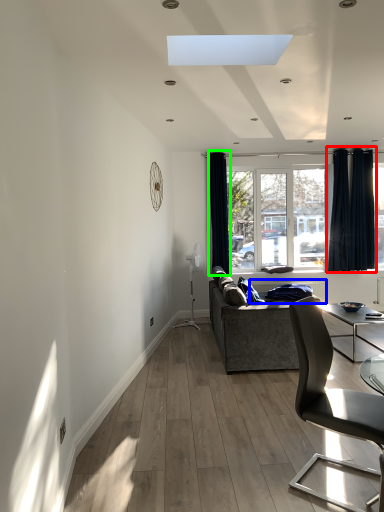
Question: Considering the real-world distances, which object is farthest from curtain (highlighted by a red box)? radiator (highlighted by a blue box) or curtain (highlighted by a green box)?

Choices:
 (A) radiator
 (B) curtain

Answer: (B)